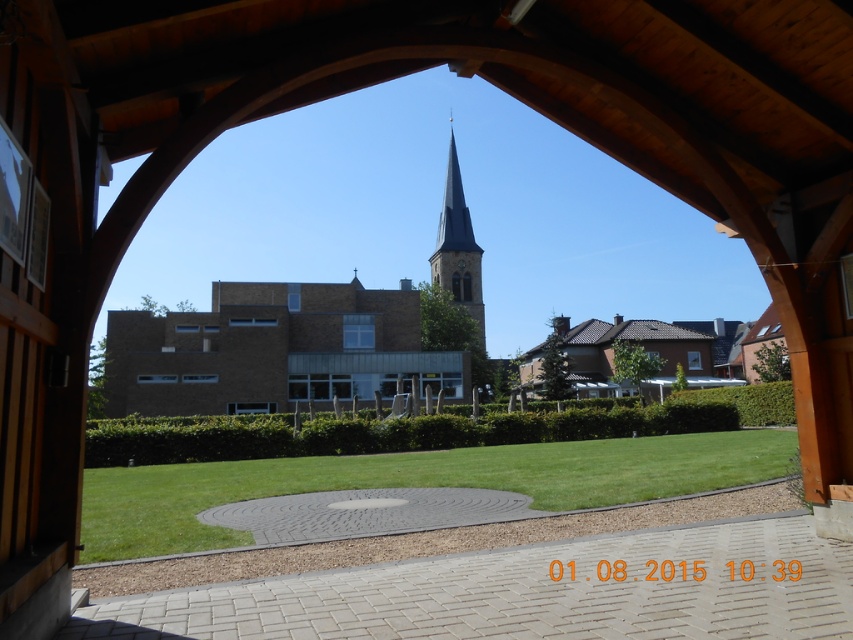
You are an architect designing a new garden layout. You want to place a small statue exactly halfway between the brown brick church at center and the smooth gray steeple at center. Given their sizes, which object will the statue be closer to?

The statue will be closer to the smooth gray steeple at center because the brown brick church at center is larger in size, meaning the steeple is positioned further away from the church, so the halfway point would be nearer to the smaller steeple.

You are standing in a park and see the brown brick church at center and the green grass at center. Which object is closer to you?

The brown brick church at center is closer to you than the green grass at center.